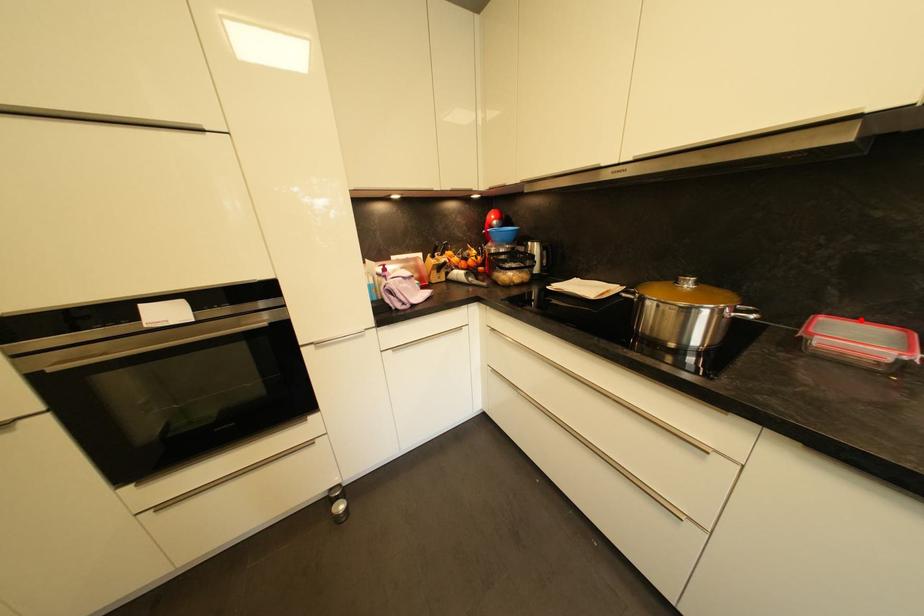
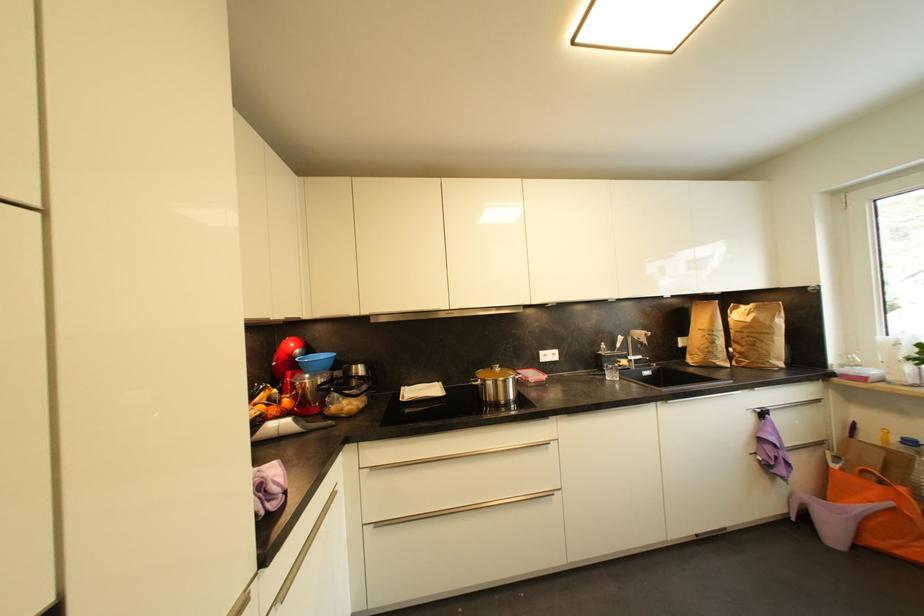
Locate, in the second image, the point that corresponds to the highlighted location in the first image.

(528, 371)